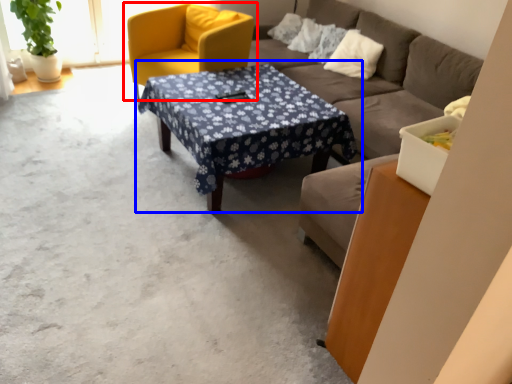
Question: Which of the following is the closest to the observer, chair (highlighted by a red box) or coffee table (highlighted by a blue box)?

Choices:
 (A) chair
 (B) coffee table

Answer: (B)